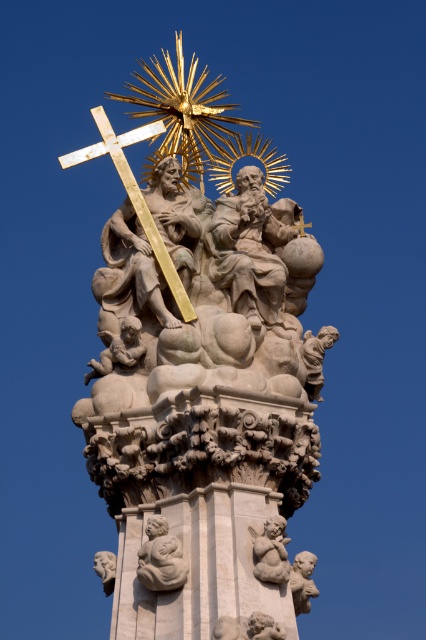
Question: Is white stone sculpture at center further to camera compared to smooth stone cherub at lower left?

Choices:
 (A) yes
 (B) no

Answer: (B)

Question: Observing the image, what is the correct spatial positioning of white stone sculpture at center in reference to gold polished cross at upper center?

Choices:
 (A) right
 (B) left

Answer: (A)

Question: Can you confirm if gold polished cross at upper center is positioned below smooth stone cherub at lower left?

Choices:
 (A) no
 (B) yes

Answer: (A)

Question: Which point is farther to the camera?

Choices:
 (A) white stone sculpture at center
 (B) gold polished cross at upper center
 (C) smooth stone cherub at lower left

Answer: (B)

Question: Which point appears farthest from the camera in this image?

Choices:
 (A) (181, 292)
 (B) (100, 564)

Answer: (A)

Question: Considering the real-world distances, which object is closest to the gold polished cross at upper center?

Choices:
 (A) white stone sculpture at center
 (B) smooth stone cherub at lower left

Answer: (A)